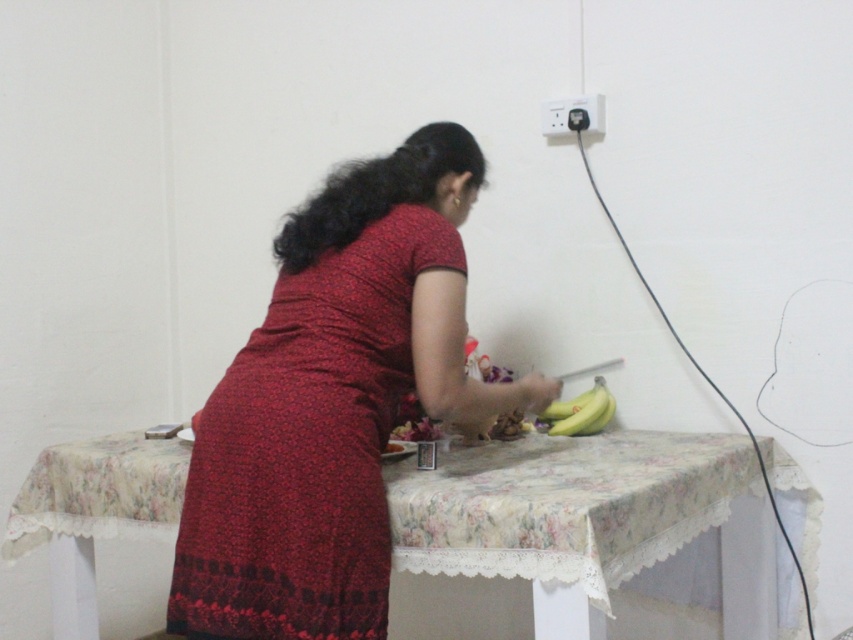
Question: Is matte red dress at center closer to camera compared to floral fabric table at center?

Choices:
 (A) no
 (B) yes

Answer: (A)

Question: Which object is farther from the camera taking this photo?

Choices:
 (A) yellow matte bananas at center
 (B) floral fabric table at center
 (C) matte red dress at center

Answer: (A)

Question: Is floral fabric table at center further to the viewer compared to yellow matte bananas at center?

Choices:
 (A) yes
 (B) no

Answer: (B)

Question: Is matte red dress at center further to camera compared to yellow matte bananas at center?

Choices:
 (A) no
 (B) yes

Answer: (A)

Question: Which of these objects is positioned farthest from the white plastic electric outlet at upper center?

Choices:
 (A) yellow matte bananas at center
 (B) floral fabric table at center

Answer: (B)

Question: Which of the following is the closest to the observer?

Choices:
 (A) (457, 461)
 (B) (546, 412)

Answer: (A)